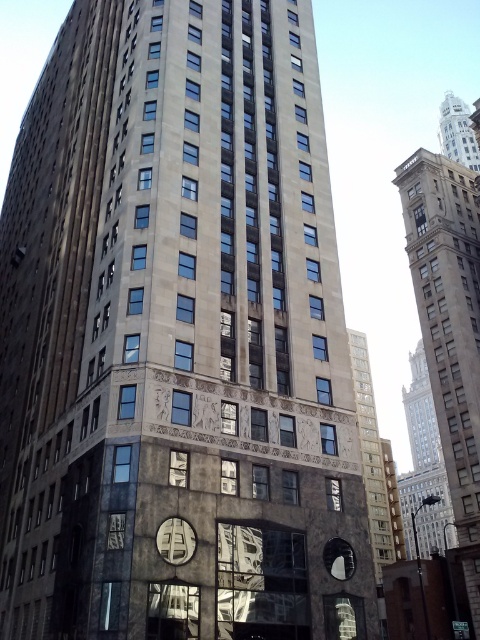
You are standing in front of the building and want to take a photo. You notice two points on the building facade marked as point 1 at coordinates [417,154] and point 2 at coordinates [464,113]. Which point will appear closer to the camera in your photo?

Point 1 at coordinates [417,154] is closer to the camera than point 2 at coordinates [464,113], so it will appear closer in the photo.

You are standing in front of the building and want to take a photo of the beige stone tower at right. Based on its position, where should you aim your camera to capture it in the frame?

The beige stone tower at right is located at point [450,326], so you should aim your camera towards the upper right section of the building to capture it in the frame.